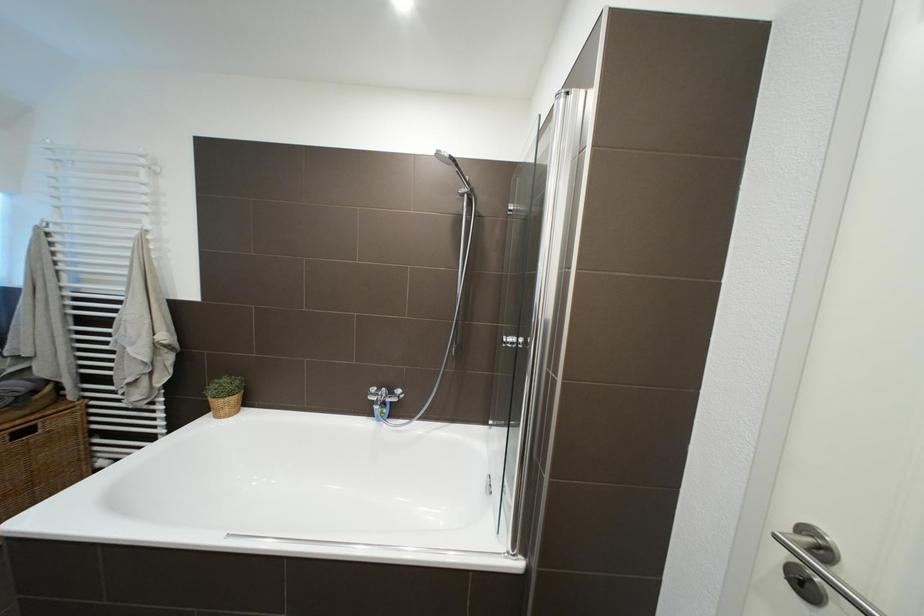
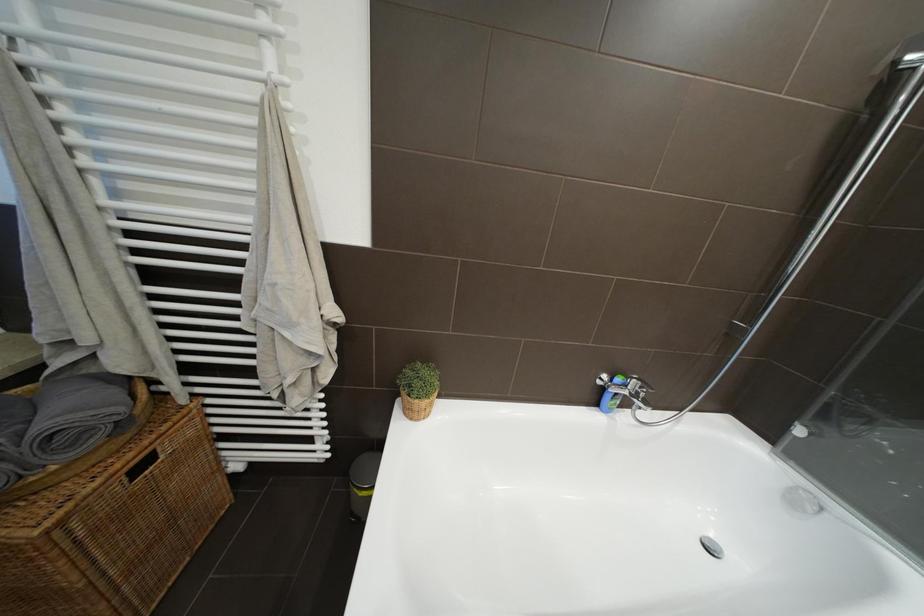
The images are taken continuously from a first-person perspective. In which direction are you moving?

The cameraman moved toward left, forward.